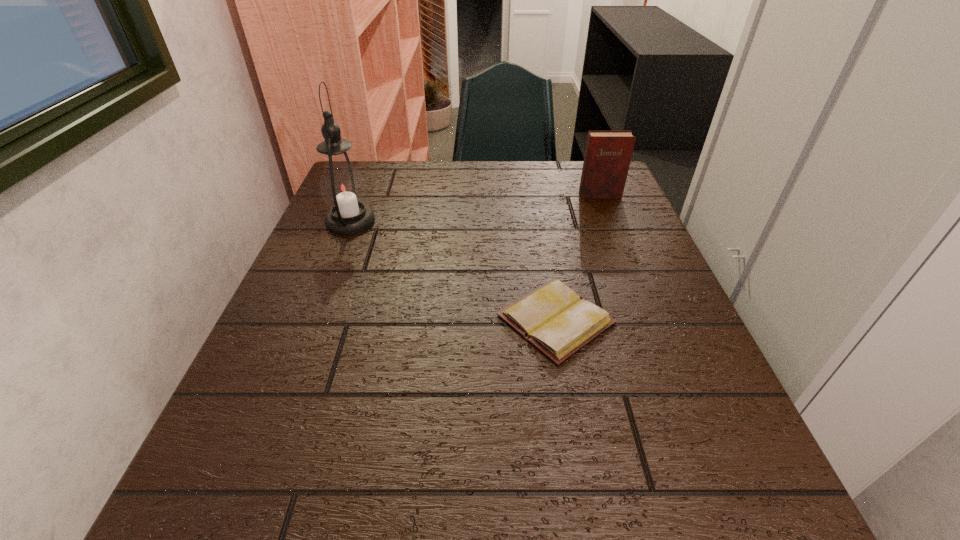
Image resolution: width=960 pixels, height=540 pixels. Identify the location of vacant region between the left diary and the oil lamp. pyautogui.click(x=453, y=271).

At what (x,y) coordinates should I click in order to perform the action: click on free space between the tallest object and the farthest object. Please return your answer as a coordinate pair (x, y). Looking at the image, I should click on (475, 208).

At what (x,y) coordinates should I click in order to perform the action: click on empty location between the nearer diary and the leftmost object. Please return your answer as a coordinate pair (x, y). Looking at the image, I should click on (453, 271).

The image size is (960, 540). What are the coordinates of `free space between the left diary and the rightmost object` in the screenshot? It's located at pyautogui.click(x=578, y=257).

You are a GUI agent. You are given a task and a screenshot of the screen. Output one action in this format:
    pyautogui.click(x=<x>, y=<y>)
    Task: Click on the free space between the second object from right to left and the leftmost object
    The height and width of the screenshot is (540, 960).
    Given the screenshot: What is the action you would take?
    pyautogui.click(x=453, y=271)

Identify the location of empty location between the right diary and the shorter diary. The height and width of the screenshot is (540, 960). (578, 257).

Where is `vacant area that lies between the nearest object and the farthest object`? The image size is (960, 540). vacant area that lies between the nearest object and the farthest object is located at coordinates tap(578, 257).

This screenshot has width=960, height=540. In order to click on vacant area that lies between the second farthest object and the right diary in this screenshot , I will do `click(475, 208)`.

Select which object is the second closest to the oil lamp. Please provide its 2D coordinates. Your answer should be formatted as a tuple, i.e. [(x, y)], where the tuple contains the x and y coordinates of a point satisfying the conditions above.

[(607, 158)]

This screenshot has width=960, height=540. I want to click on object that is the closest to the nearest object, so click(342, 186).